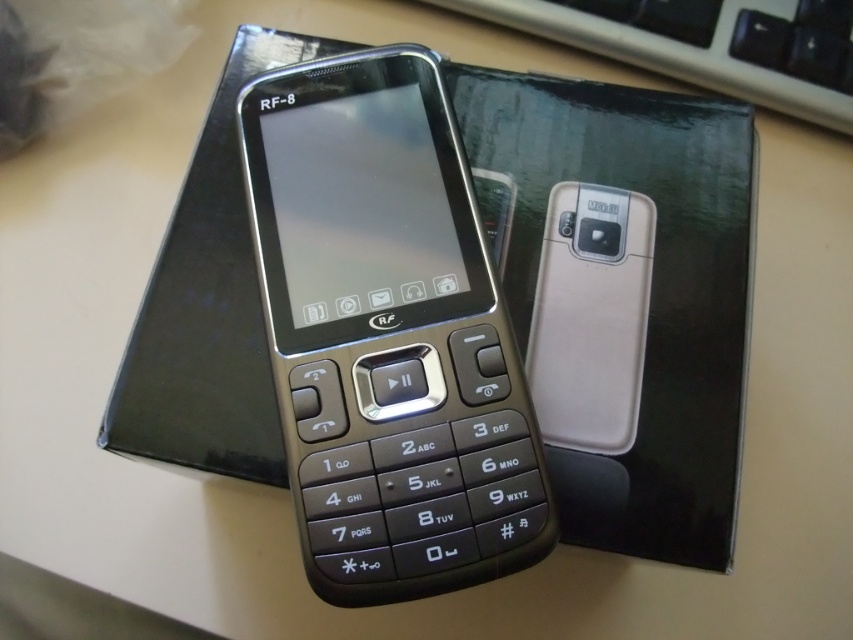
Does matte black phone at center have a lesser width compared to black plastic keyboard at upper center?

Yes.

Does matte black phone at center have a smaller size compared to black plastic keyboard at upper center?

No.

This screenshot has width=853, height=640. In order to click on matte black phone at center in this screenshot , I will do `click(387, 333)`.

Identify the location of matte black phone at center. (387, 333).